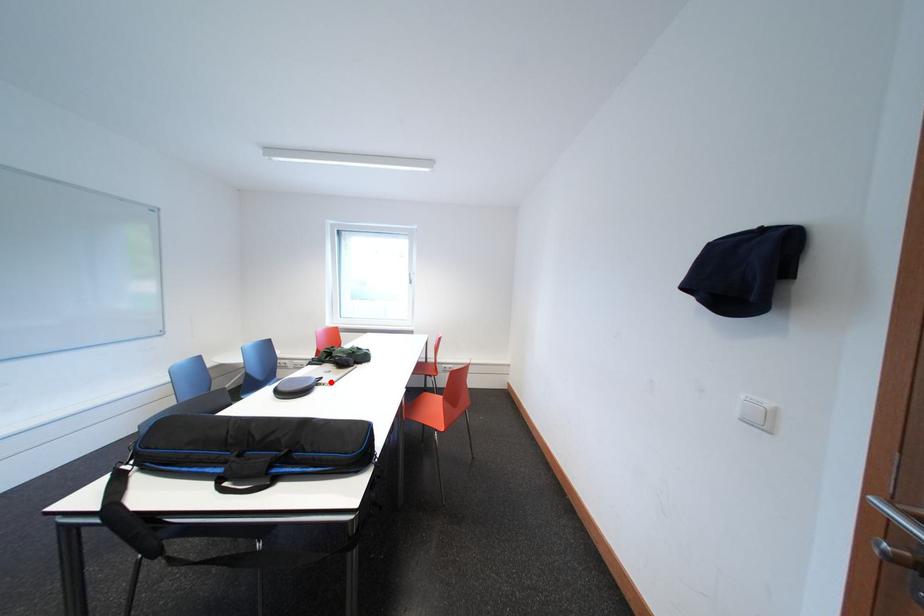
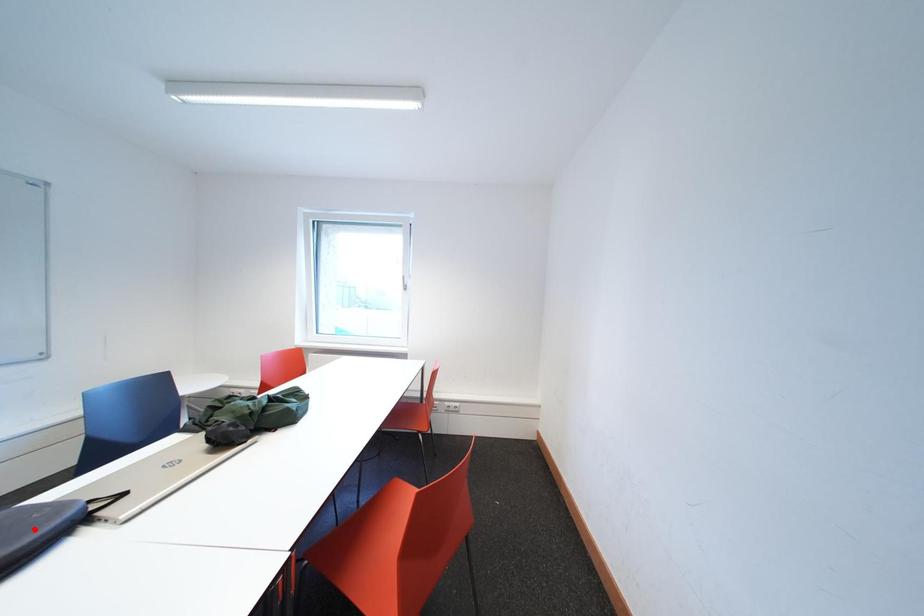
I am providing you with two images of the same scene from different viewpoints. A red point is marked on the first image and another point is marked on the second image. Is the red point in image1 aligned with the point shown in image2?

No